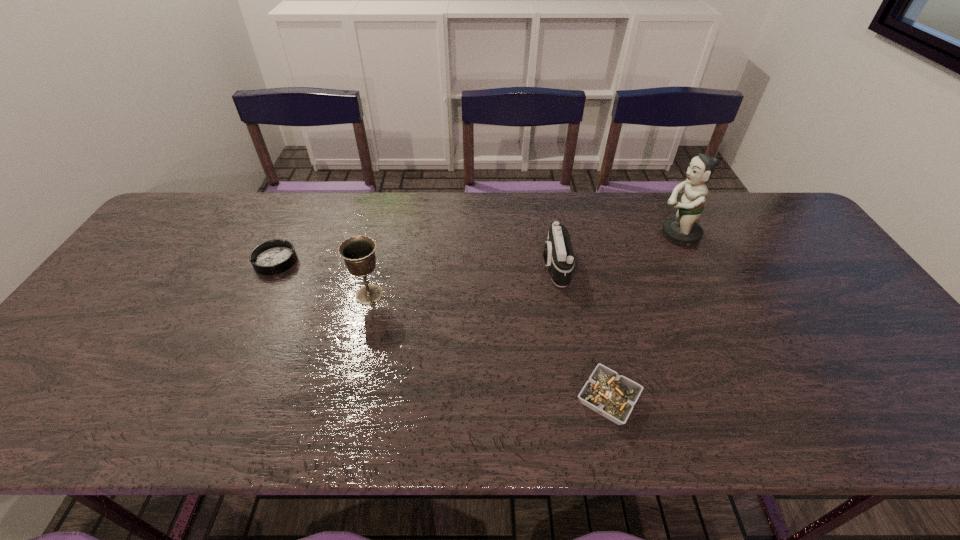
The height and width of the screenshot is (540, 960). What are the coordinates of `vacant area located 0.400m on the front-facing side of the tallest object` in the screenshot? It's located at (526, 235).

In order to click on vacant space located on the front-facing side of the tallest object in this screenshot , I will do `click(555, 235)`.

Where is `vacant space located on the left of the second object from left to right`? vacant space located on the left of the second object from left to right is located at coordinates (221, 295).

Locate an element on the screen. vacant area located on the front lens of the third shortest object is located at coordinates (492, 267).

This screenshot has height=540, width=960. Find the location of `vacant space located 0.370m on the front lens of the third shortest object`. vacant space located 0.370m on the front lens of the third shortest object is located at coordinates (411, 267).

This screenshot has width=960, height=540. In order to click on free spot located 0.110m on the front lens of the third shortest object in this screenshot , I will do click(502, 267).

The image size is (960, 540). I want to click on vacant space located 0.120m on the left of the farther ashtray, so click(213, 261).

You are a GUI agent. You are given a task and a screenshot of the screen. Output one action in this format:
    pyautogui.click(x=<x>, y=<y>)
    Task: Click on the vacant area situated on the left of the nearest object
    Image resolution: width=960 pixels, height=540 pixels.
    Given the screenshot: What is the action you would take?
    pyautogui.click(x=488, y=400)

The image size is (960, 540). Identify the location of object positioned at the far edge. (683, 230).

Image resolution: width=960 pixels, height=540 pixels. Identify the location of object present at the near edge. (613, 396).